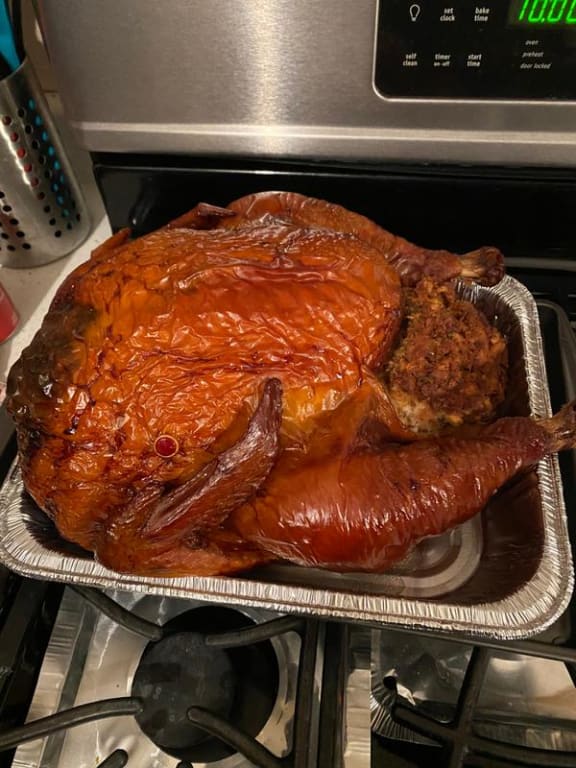
Identify the location of thermometer. This screenshot has height=768, width=576. (166, 441).